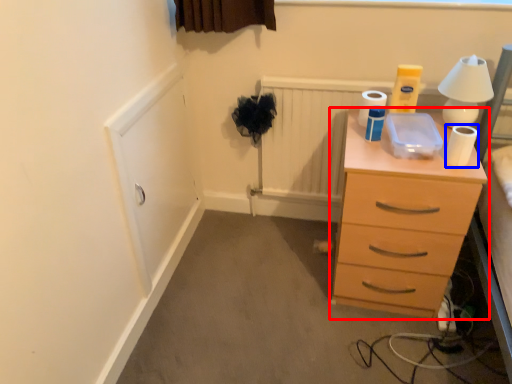
Question: Which object is closer to the camera taking this photo, chest of drawers (highlighted by a red box) or toilet paper (highlighted by a blue box)?

Choices:
 (A) chest of drawers
 (B) toilet paper

Answer: (A)